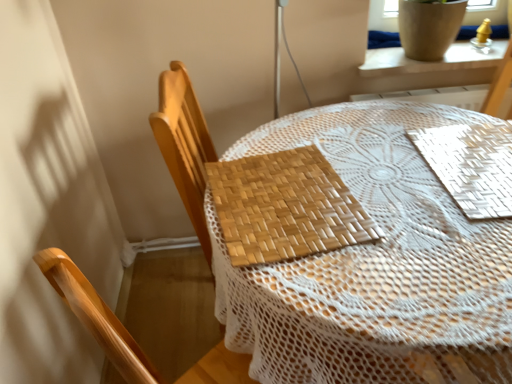
Locate an element on the screen. free space on the front side of woven wood placemat at center, the 2th mat positioned from the right is located at coordinates (364, 292).